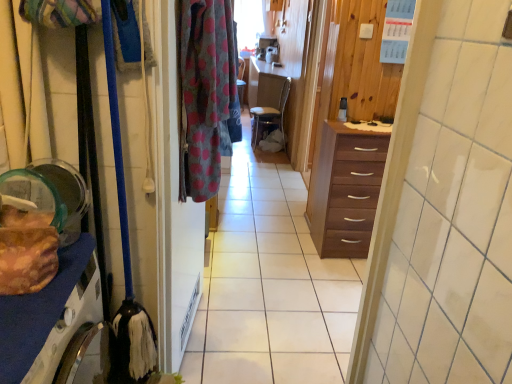
Question: Considering the positions of translucent plastic container at left and white glossy counter top at center in the image, is translucent plastic container at left taller or shorter than white glossy counter top at center?

Choices:
 (A) tall
 (B) short

Answer: (A)

Question: Is translucent plastic container at left situated inside white glossy counter top at center or outside?

Choices:
 (A) inside
 (B) outside

Answer: (B)

Question: Which of these objects is positioned closest to the translucent plastic container at left?

Choices:
 (A) polka dot fabric screen door at center
 (B) polka dot fabric at center
 (C) matte black coffee cup at center
 (D) white glossy counter top at center
 (E) wooden cabinet at center

Answer: (A)

Question: Which of these objects is positioned farthest from the dark brown wood drawer at center, arranged as the 1th cabinetry when viewed from the right?

Choices:
 (A) polka dot fabric screen door at center
 (B) translucent plastic container at left
 (C) brown woven chair at center
 (D) white glossy counter top at center
 (E) wooden cabinet at center

Answer: (C)